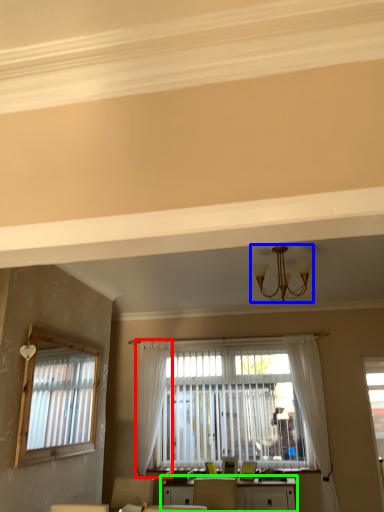
Question: Which object is the closest to the curtain (highlighted by a red box)? Choose among these: light fixture (highlighted by a blue box) or table (highlighted by a green box).

Choices:
 (A) light fixture
 (B) table

Answer: (B)